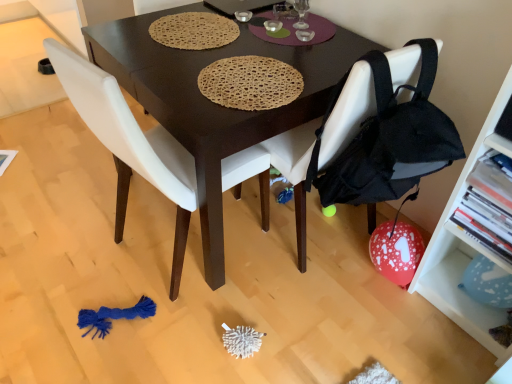
Image resolution: width=512 pixels, height=384 pixels. In order to click on vacant area to the left of dark brown wood desk at center in this screenshot , I will do `click(62, 202)`.